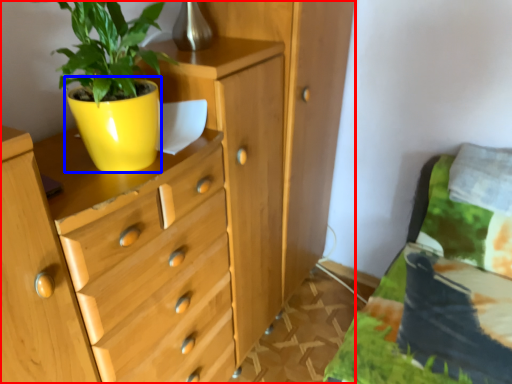
Question: Among these objects, which one is nearest to the camera, chest of drawers (highlighted by a red box) or flowerpot (highlighted by a blue box)?

Choices:
 (A) chest of drawers
 (B) flowerpot

Answer: (A)